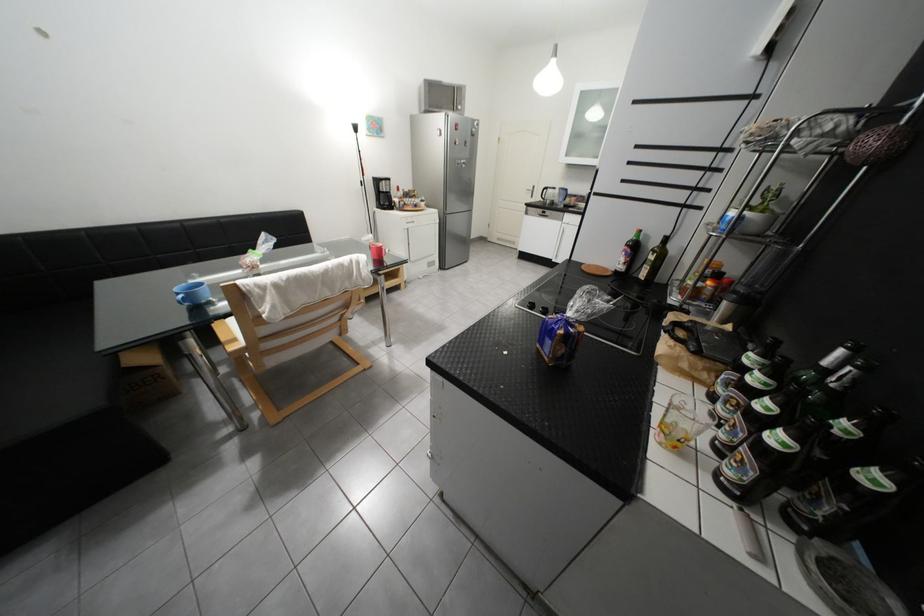
Find the location of a particular element. packaged bread is located at coordinates (558, 339).